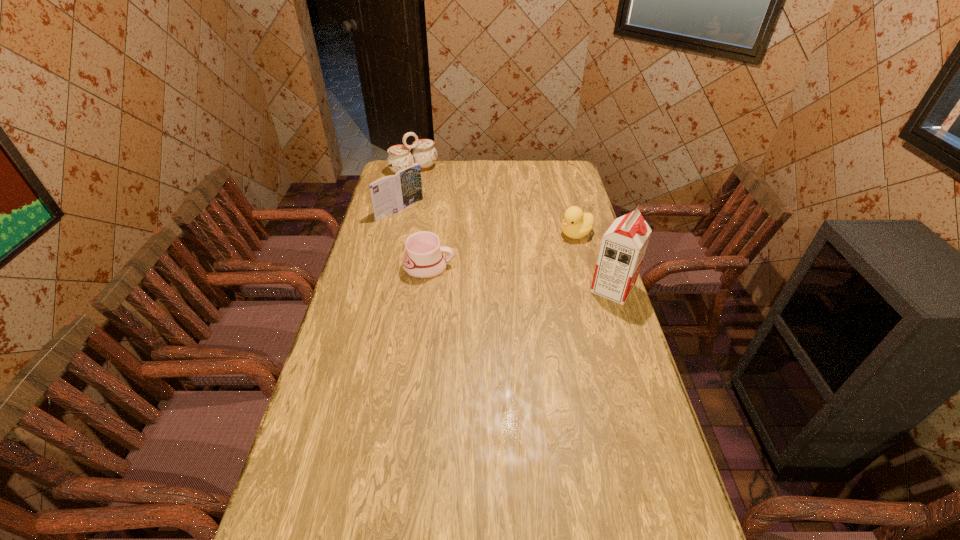
Find the location of `mug`. mug is located at coordinates (423, 259).

The image size is (960, 540). I want to click on the tallest object, so click(623, 246).

Locate an element on the screen. the fourth tallest object is located at coordinates (576, 224).

Locate an element on the screen. duck is located at coordinates (576, 224).

This screenshot has width=960, height=540. Identify the location of book. (390, 194).

Identify the location of the farthest object. (424, 153).

You are a GUI agent. You are given a task and a screenshot of the screen. Output one action in this format:
    pyautogui.click(x=<x>, y=<y>)
    Task: Click on the free space located 0.330m on the side with the handle of the mug
    Image resolution: width=960 pixels, height=540 pixels.
    Given the screenshot: What is the action you would take?
    pyautogui.click(x=542, y=267)

I want to click on vacant region located 0.330m on the front of the soya milk, so click(x=645, y=388).

This screenshot has height=540, width=960. Find the location of `free space located on the front-facing side of the third nearest object`. free space located on the front-facing side of the third nearest object is located at coordinates (487, 280).

Find the location of a particular element. The height and width of the screenshot is (540, 960). free spot located 0.220m on the front-facing side of the third nearest object is located at coordinates (523, 261).